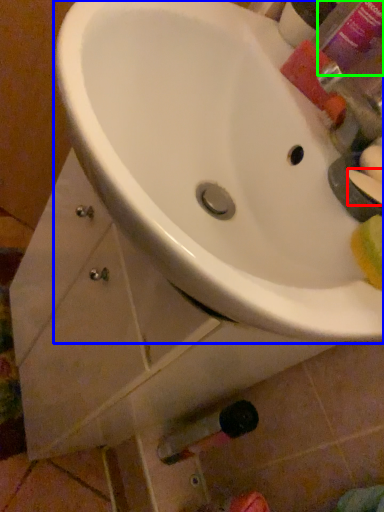
Question: Which object is the farthest from soap (highlighted by a red box)? Choose among these: sink (highlighted by a blue box) or mouthwash (highlighted by a green box).

Choices:
 (A) sink
 (B) mouthwash

Answer: (B)